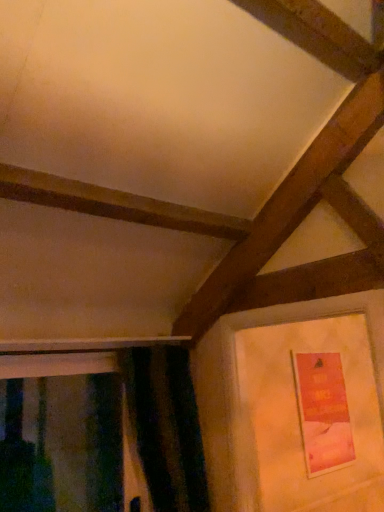
Describe the element at coordinates (323, 411) in the screenshot. I see `matte pink paper at lower right` at that location.

You are a GUI agent. You are given a task and a screenshot of the screen. Output one action in this format:
    pyautogui.click(x=<x>, y=<y>)
    Task: Click on the matte pink paper at lower right
    The height and width of the screenshot is (512, 384).
    Given the screenshot: What is the action you would take?
    pyautogui.click(x=323, y=411)

The height and width of the screenshot is (512, 384). I want to click on matte pink paper at lower right, so click(x=323, y=411).